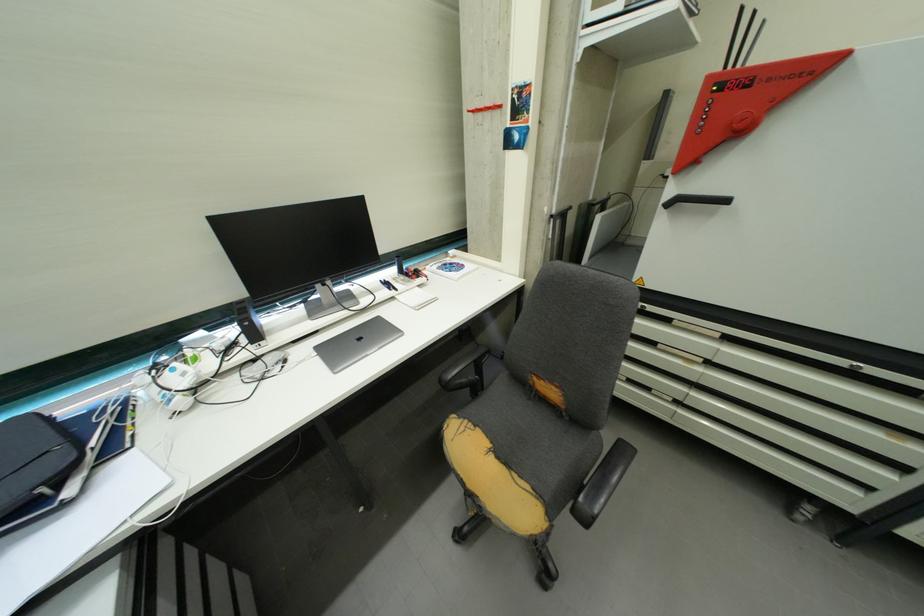
Where is `black laptop case`? The width and height of the screenshot is (924, 616). black laptop case is located at coordinates click(x=33, y=456).